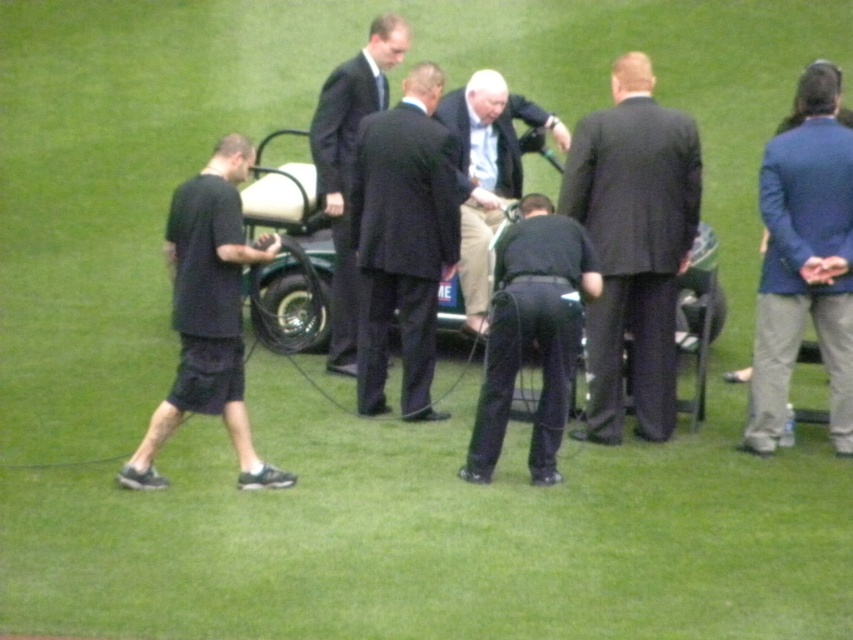
You are a photographer positioned behind the golf cart and want to take a photo that includes both the blue woolen blazer at right and the light blue shirt at center. Which of these two items will appear larger in the photo?

The blue woolen blazer at right will appear larger in the photo because it is closer to the viewer than the light blue shirt at center.